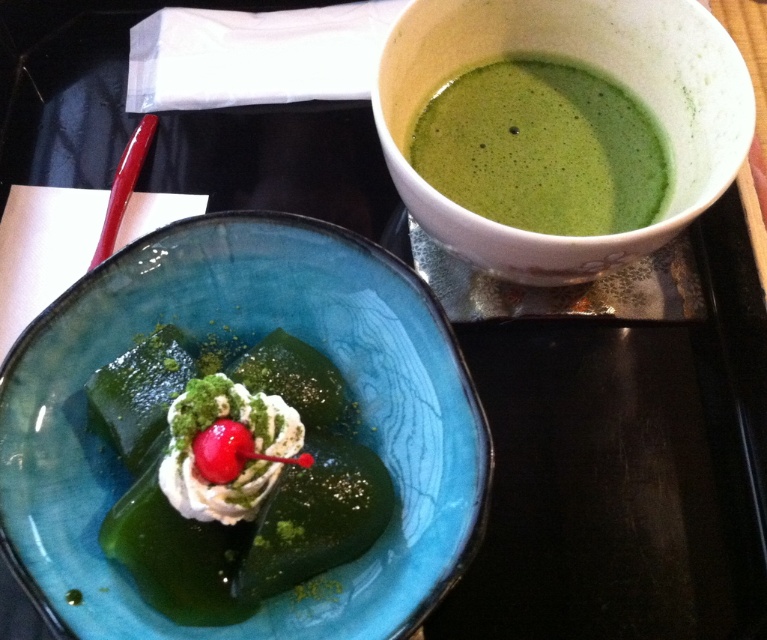
You are a food critic evaluating the presentation of the dessert and tea set. Which of the two green items, the green gelatinous dessert at center or the green frothy soup at upper right, has a larger portion size?

The green gelatinous dessert at center has a larger portion size than the green frothy soup at upper right.

From the picture: You are planning to place the green gelatinous dessert at center into the translucent glass bowl at center. Based on their sizes, will the dessert fit inside the bowl?

The translucent glass bowl at center might be wider than green gelatinous dessert at center, so there is a possibility that the dessert will fit inside the bowl.

You are a food stylist arranging a photo shoot setup. You need to place a new dessert plate between the green gelatinous dessert at center and the white ceramic bowl at upper right. Based on their current positions, where should you position the new dessert plate to maintain symmetry?

The green gelatinous dessert at center is to the left of the white ceramic bowl at upper right, so to maintain symmetry, the new dessert plate should be placed equidistant from both, centered between them.